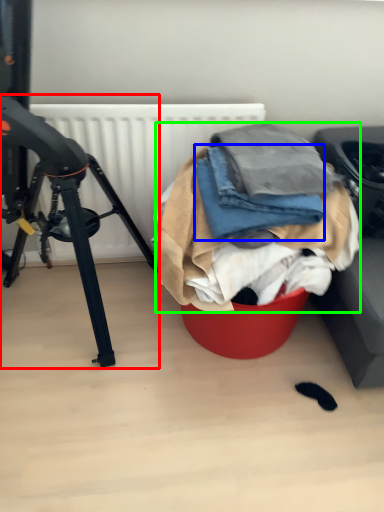
Question: Based on their relative distances, which object is farther from tripod (highlighted by a red box)? Choose from clothing (highlighted by a blue box) and clothing (highlighted by a green box).

Choices:
 (A) clothing
 (B) clothing

Answer: (A)